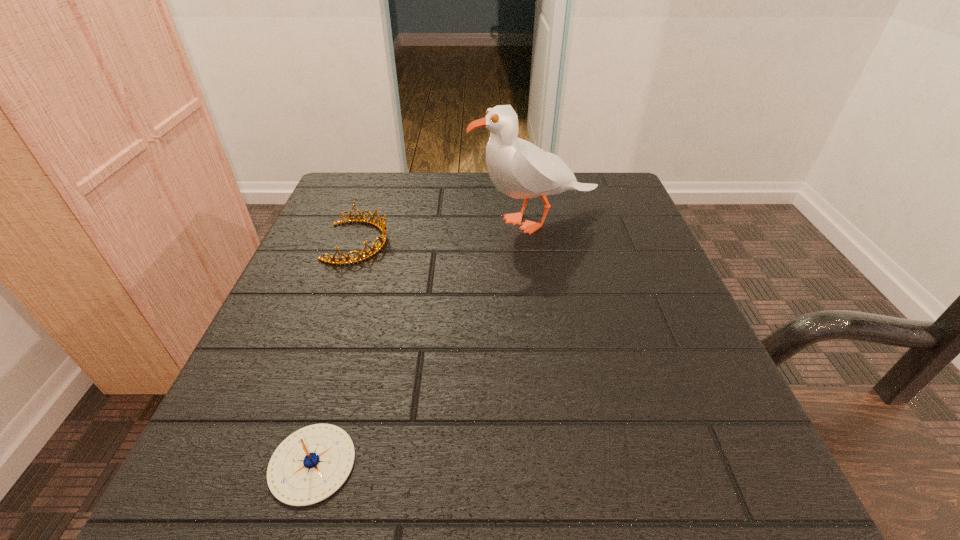
Where is `gull at the far edge`? The image size is (960, 540). gull at the far edge is located at coordinates (518, 168).

I want to click on tiara that is at the far edge, so click(x=381, y=226).

You are a GUI agent. You are given a task and a screenshot of the screen. Output one action in this format:
    pyautogui.click(x=<x>, y=<y>)
    Task: Click on the object present at the near edge
    
    Given the screenshot: What is the action you would take?
    pyautogui.click(x=312, y=463)

Identify the location of tiara that is at the left edge. (381, 226).

I want to click on compass that is at the left edge, so click(312, 463).

This screenshot has width=960, height=540. Identify the location of object that is positioned at the right edge. (518, 168).

The image size is (960, 540). I want to click on object at the far left corner, so click(x=381, y=226).

At what (x,y) coordinates should I click in order to perform the action: click on object present at the near left corner. Please return your answer as a coordinate pair (x, y). Image resolution: width=960 pixels, height=540 pixels. Looking at the image, I should click on (312, 463).

Locate an element on the screen. The width and height of the screenshot is (960, 540). object that is at the far right corner is located at coordinates (518, 168).

This screenshot has width=960, height=540. In the image, there is a desktop. In order to click on vacant space at the far edge in this screenshot , I will do `click(436, 188)`.